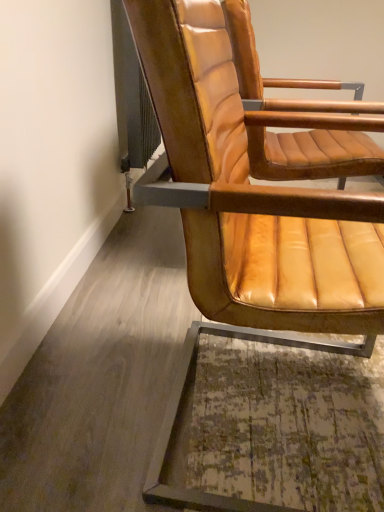
Find the location of a particular element. The width and height of the screenshot is (384, 512). free region on the left part of leather at right, the first chair viewed from the front is located at coordinates (97, 384).